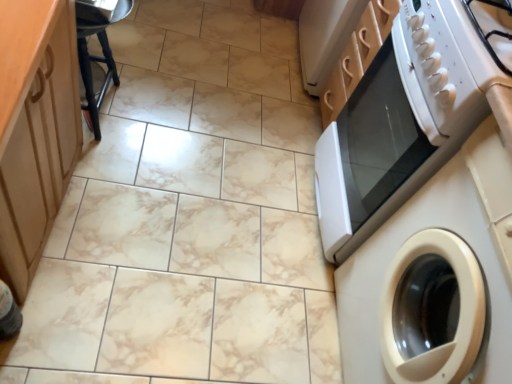
Question: Could you tell me if white glossy washing machine at right is turned towards black plastic bar stool at upper left?

Choices:
 (A) no
 (B) yes

Answer: (A)

Question: Considering the relative sizes of white glossy washing machine at right and black plastic bar stool at upper left in the image provided, is white glossy washing machine at right smaller than black plastic bar stool at upper left?

Choices:
 (A) no
 (B) yes

Answer: (A)

Question: Is white glossy washing machine at right surrounding black plastic bar stool at upper left?

Choices:
 (A) no
 (B) yes

Answer: (A)

Question: Is white glossy washing machine at right bigger than black plastic bar stool at upper left?

Choices:
 (A) yes
 (B) no

Answer: (A)

Question: Considering the relative sizes of white glossy washing machine at right and black plastic bar stool at upper left in the image provided, is white glossy washing machine at right thinner than black plastic bar stool at upper left?

Choices:
 (A) no
 (B) yes

Answer: (A)

Question: From a real-world perspective, is white glossy microwave at upper right above or below white glossy gas stove at upper right?

Choices:
 (A) above
 (B) below

Answer: (B)

Question: Considering their positions, is white glossy microwave at upper right located in front of or behind white glossy gas stove at upper right?

Choices:
 (A) front
 (B) behind

Answer: (B)

Question: Does point (378, 195) appear closer or farther from the camera than point (440, 122)?

Choices:
 (A) closer
 (B) farther

Answer: (B)

Question: Considering the positions of white glossy microwave at upper right and white glossy gas stove at upper right in the image, is white glossy microwave at upper right taller or shorter than white glossy gas stove at upper right?

Choices:
 (A) tall
 (B) short

Answer: (A)

Question: Does point (473, 39) appear closer or farther from the camera than point (106, 61)?

Choices:
 (A) farther
 (B) closer

Answer: (B)

Question: Is white glossy microwave at upper right to the left or to the right of black plastic bar stool at upper left in the image?

Choices:
 (A) right
 (B) left

Answer: (A)

Question: From the image's perspective, is white glossy microwave at upper right positioned above or below black plastic bar stool at upper left?

Choices:
 (A) above
 (B) below

Answer: (B)

Question: Is white glossy microwave at upper right wider or thinner than black plastic bar stool at upper left?

Choices:
 (A) thin
 (B) wide

Answer: (B)

Question: From the image's perspective, is white glossy washing machine at right located above or below white glossy gas stove at upper right?

Choices:
 (A) below
 (B) above

Answer: (A)

Question: Is white glossy washing machine at right wider or thinner than white glossy gas stove at upper right?

Choices:
 (A) thin
 (B) wide

Answer: (B)